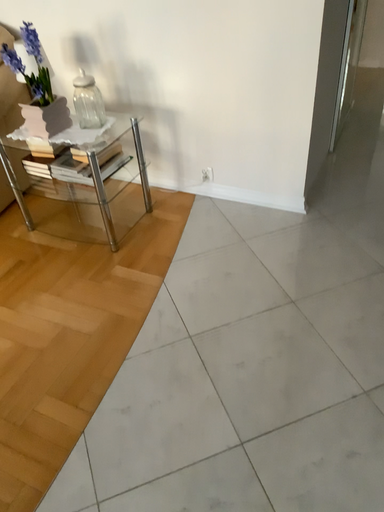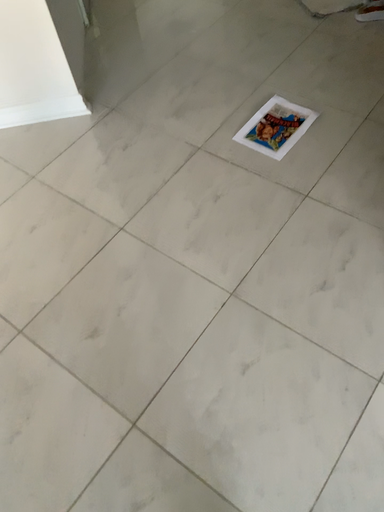
Question: Which way did the camera rotate in the video?

Choices:
 (A) rotated left
 (B) rotated right

Answer: (B)